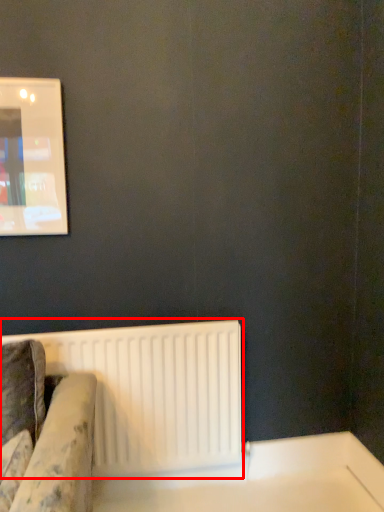
Question: In this image, where is radiator (annotated by the red box) located relative to table?

Choices:
 (A) left
 (B) right

Answer: (A)